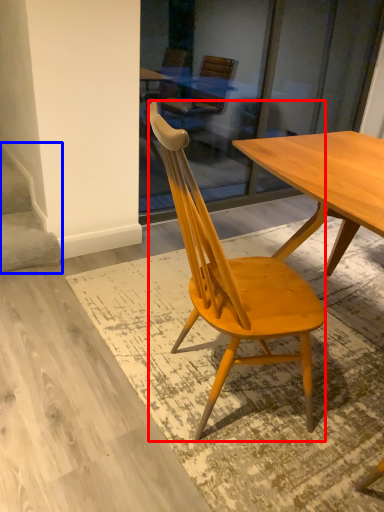
Question: Which of the following is the farthest to the observer, chair (highlighted by a red box) or stairwell (highlighted by a blue box)?

Choices:
 (A) chair
 (B) stairwell

Answer: (B)